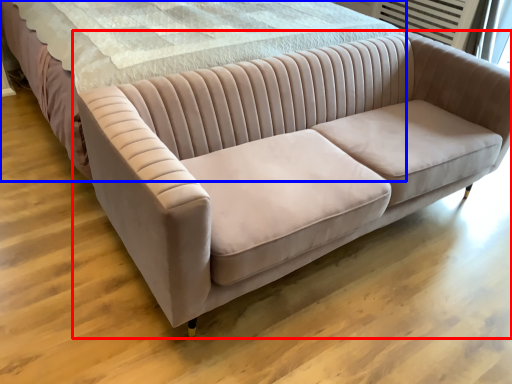
Question: Which of the following is the farthest to the observer, studio couch (highlighted by a red box) or bed (highlighted by a blue box)?

Choices:
 (A) studio couch
 (B) bed

Answer: (B)